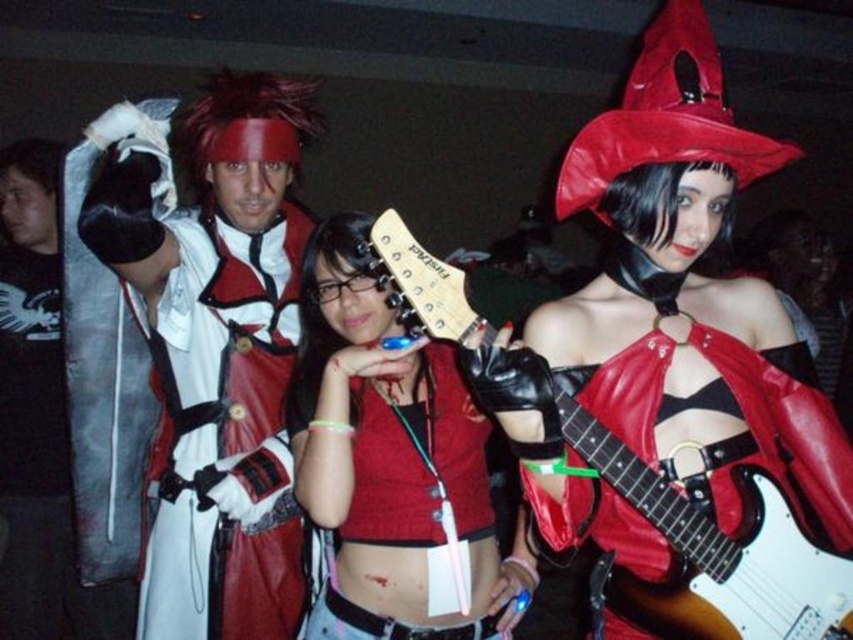
Is white leather jacket at upper left positioned at the back of matte red leather jacket at center?

Yes, white leather jacket at upper left is further from the viewer.

Does white leather jacket at upper left have a greater height compared to matte red leather jacket at center?

Yes.

Describe the element at coordinates (218, 355) in the screenshot. This screenshot has height=640, width=853. I see `white leather jacket at upper left` at that location.

Locate an element on the screen. Image resolution: width=853 pixels, height=640 pixels. white leather jacket at upper left is located at coordinates (218, 355).

Who is shorter, matte red leather jacket at center or white glossy electric guitar at center?

Standing shorter between the two is white glossy electric guitar at center.

Which is behind, point (486, 580) or point (805, 609)?

The point (486, 580) is behind.

Consider the image. Measure the distance between point (331, 342) and camera.

Point (331, 342) and camera are 5.25 feet apart.

At what (x,y) coordinates should I click in order to perform the action: click on matte red leather jacket at center. Please return your answer as a coordinate pair (x, y). The image size is (853, 640). Looking at the image, I should click on (392, 464).

Is white leather jacket at upper left behind brushed metal sword at left?

No, it is not.

How distant is white leather jacket at upper left from brushed metal sword at left?

The distance of white leather jacket at upper left from brushed metal sword at left is 31.37 inches.

I want to click on white leather jacket at upper left, so click(x=218, y=355).